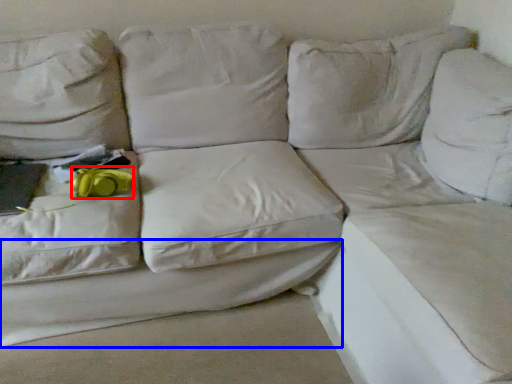
Question: Which object appears farthest to the camera in this image, stuff (highlighted by a red box) or sheet (highlighted by a blue box)?

Choices:
 (A) stuff
 (B) sheet

Answer: (A)